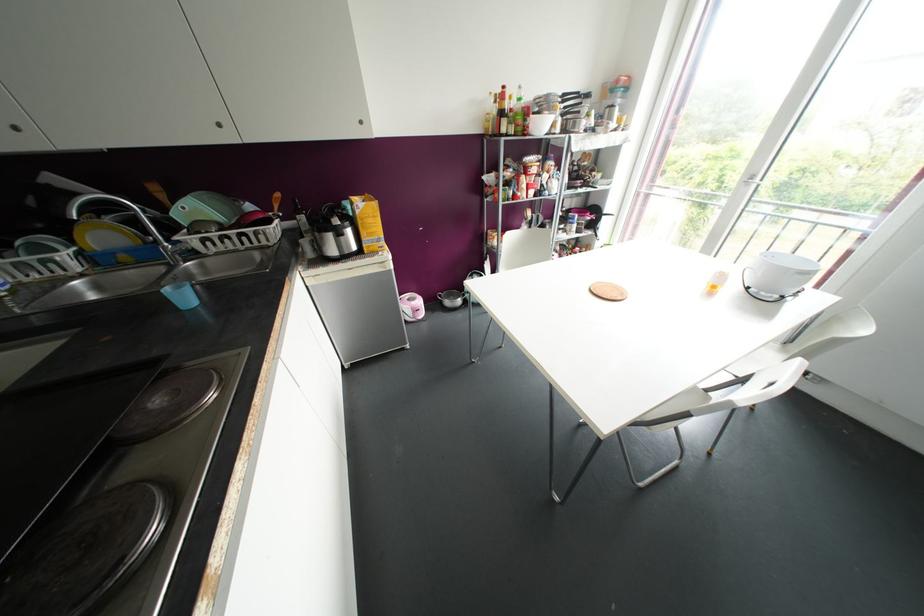
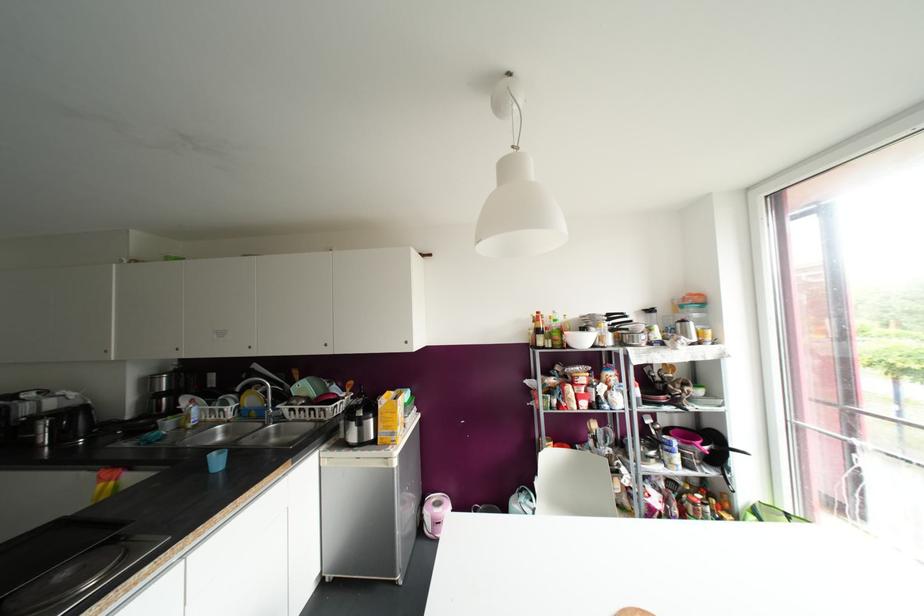
Based on the continuous images, in which direction is the camera rotating?

The camera rotated toward left-up.